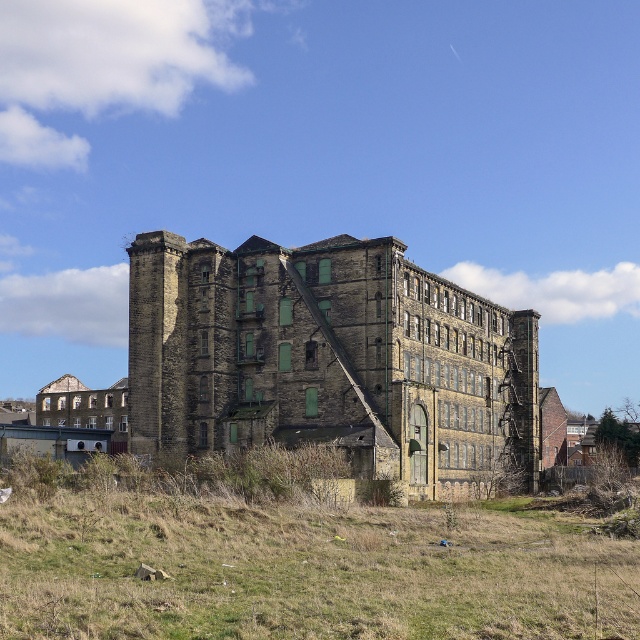
You are a landscape architect evaluating the site. The green grass at lower center and the brown stone building at center are both visible from your current position. Which object occupies a larger area in the scene?

The brown stone building at center is larger than the green grass at lower center, so it occupies a larger area in the scene.

You are a maintenance worker tasked with checking the condition of the green grass at lower center and the brown stone building at center. From your current position, which object is closer to you?

The green grass at lower center is closer because it is in front of the brown stone building at center.

Based on the photo, you are a landscape architect evaluating the site for a new garden. You notice the green grass at lower center and the brown stone building at center. Which area has a smaller width?

The green grass at lower center has a smaller width than the brown stone building at center.